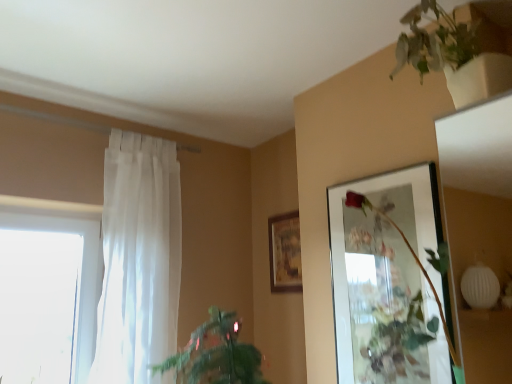
Question: Is matte glass picture frame at upper right, the 2th picture frame in the back-to-front sequence, completely or partially inside green matte plant at upper right, which is counted as the first houseplant, starting from the right?

Choices:
 (A) yes
 (B) no

Answer: (B)

Question: Does green matte plant at upper right, arranged as the second houseplant when ordered from the bottom, appear on the left side of matte glass picture frame at upper right, the 2th picture frame in the back-to-front sequence?

Choices:
 (A) yes
 (B) no

Answer: (B)

Question: Is green matte plant at upper right, arranged as the second houseplant when ordered from the bottom, taller than matte glass picture frame at upper right, the 2th picture frame viewed from the left?

Choices:
 (A) yes
 (B) no

Answer: (B)

Question: Is green matte plant at upper right, arranged as the second houseplant when ordered from the bottom, thinner than matte glass picture frame at upper right, positioned as the 1th picture frame in front-to-back order?

Choices:
 (A) no
 (B) yes

Answer: (A)

Question: From the image's perspective, is green matte plant at upper right, which appears as the first houseplant when viewed from the top, located above matte glass picture frame at upper right, marked as the 1th picture frame in a right-to-left arrangement?

Choices:
 (A) no
 (B) yes

Answer: (B)

Question: Is green matte plant at upper right, which is counted as the first houseplant, starting from the right, smaller than matte glass picture frame at upper right, the 2th picture frame in the back-to-front sequence?

Choices:
 (A) no
 (B) yes

Answer: (A)

Question: Is white sheer curtain at left behind green leafy plant at lower left, marked as the second houseplant in a top-to-bottom arrangement?

Choices:
 (A) yes
 (B) no

Answer: (A)

Question: Is white sheer curtain at left not near green leafy plant at lower left, which is the 1th houseplant from left to right?

Choices:
 (A) no
 (B) yes

Answer: (A)

Question: Considering the relative positions of white sheer curtain at left and green leafy plant at lower left, which appears as the second houseplant when viewed from the right, in the image provided, is white sheer curtain at left to the right of green leafy plant at lower left, which appears as the second houseplant when viewed from the right, from the viewer's perspective?

Choices:
 (A) no
 (B) yes

Answer: (A)

Question: From the image's perspective, is white sheer curtain at left located beneath green leafy plant at lower left, marked as the second houseplant in a top-to-bottom arrangement?

Choices:
 (A) yes
 (B) no

Answer: (B)

Question: Is white sheer curtain at left next to green leafy plant at lower left, which appears as the second houseplant when viewed from the right?

Choices:
 (A) yes
 (B) no

Answer: (B)

Question: Considering the relative positions of white sheer curtain at left and green leafy plant at lower left, which is the 1th houseplant from left to right, in the image provided, is white sheer curtain at left to the left of green leafy plant at lower left, which is the 1th houseplant from left to right, from the viewer's perspective?

Choices:
 (A) no
 (B) yes

Answer: (B)

Question: Can you confirm if matte glass picture frame at upper right, the 2th picture frame in the back-to-front sequence, is thinner than green leafy plant at lower left, which appears as the second houseplant when viewed from the right?

Choices:
 (A) yes
 (B) no

Answer: (A)